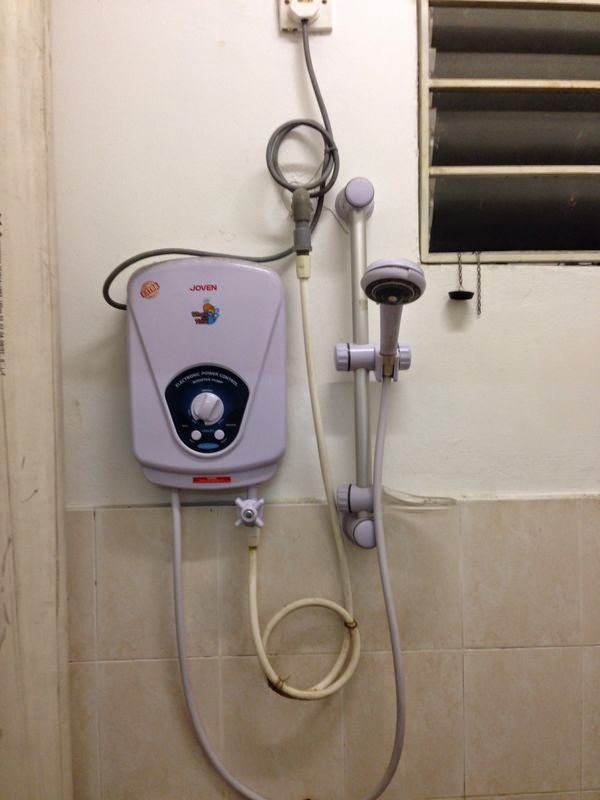
Locate an element on the screen. beige tiled bathroom wall is located at coordinates (270, 713).